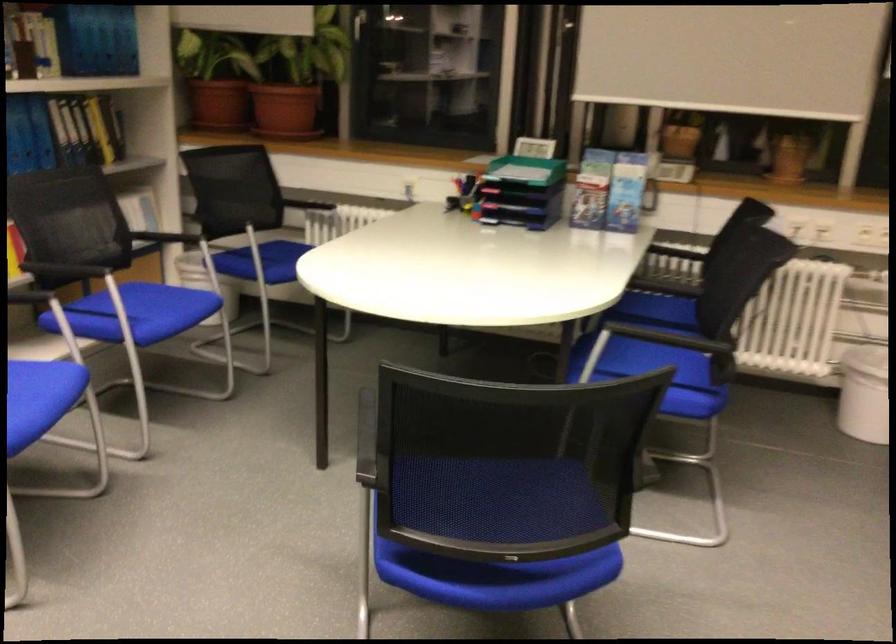
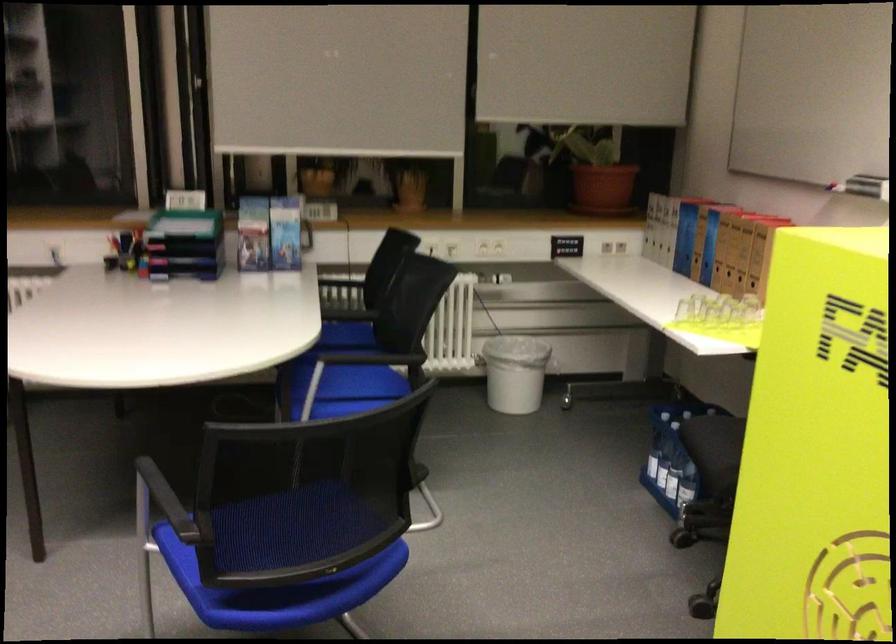
Find the pixel in the second image that matches the point at 684,247 in the first image.

(340, 279)